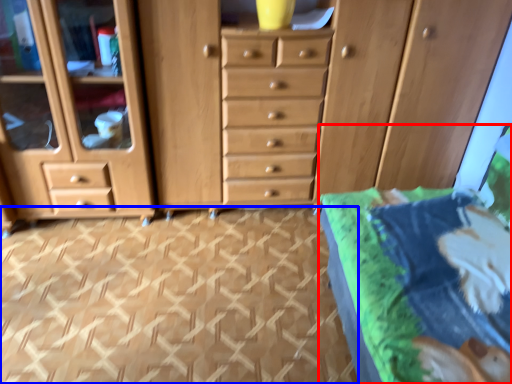
Question: Among these objects, which one is farthest to the camera, bed (highlighted by a red box) or tile (highlighted by a blue box)?

Choices:
 (A) bed
 (B) tile

Answer: (B)